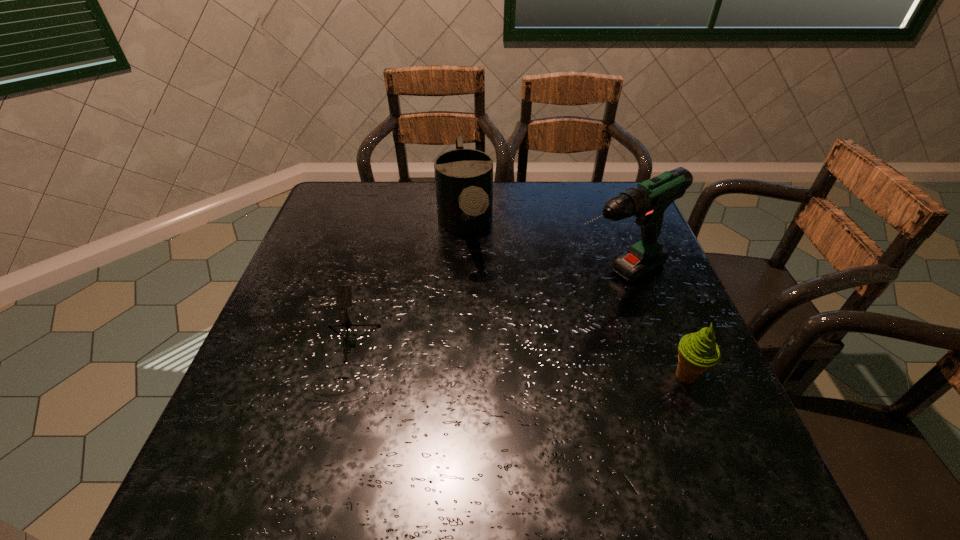
At what (x,y) coordinates should I click in order to perform the action: click on blank space that satisfies the following two spatial constraints: 1. on the stand of the third tallest object; 2. on the left side of the shortest object. Please return your answer as a coordinate pair (x, y). Looking at the image, I should click on click(339, 376).

The width and height of the screenshot is (960, 540). I want to click on free space that satisfies the following two spatial constraints: 1. on the stand of the leftmost object; 2. on the right side of the second shortest object, so click(339, 376).